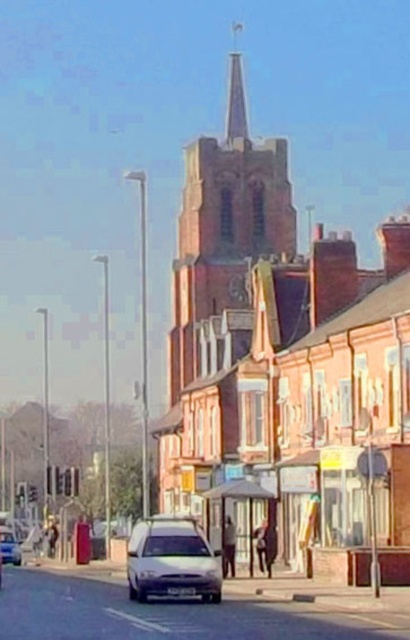
Does brick church steeple at center have a greater height compared to white matte car at lower left?

Indeed, brick church steeple at center has a greater height compared to white matte car at lower left.

Which is above, brick church steeple at center or white matte car at lower left?

brick church steeple at center is higher up.

This screenshot has width=410, height=640. In order to click on brick church steeple at center in this screenshot , I will do `click(282, 349)`.

Is silver metallic van at center positioned behind white matte car at lower left?

No, it is in front of white matte car at lower left.

In the scene shown: Can you confirm if silver metallic van at center is thinner than white matte car at lower left?

Indeed, silver metallic van at center has a lesser width compared to white matte car at lower left.

Who is more distant from viewer, (x=136, y=573) or (x=0, y=541)?

Point (x=0, y=541)

Where is `silver metallic van at center`? silver metallic van at center is located at coordinates (172, 561).

Can you confirm if white matte car at lower left is thinner than white matte car at center?

No, white matte car at lower left is not thinner than white matte car at center.

Which of these two, white matte car at lower left or white matte car at center, stands shorter?

Standing shorter between the two is white matte car at center.

Which is behind, point (0, 548) or point (0, 540)?

Point (0, 540)

This screenshot has width=410, height=640. Find the location of `white matte car at lower left`. white matte car at lower left is located at coordinates (9, 547).